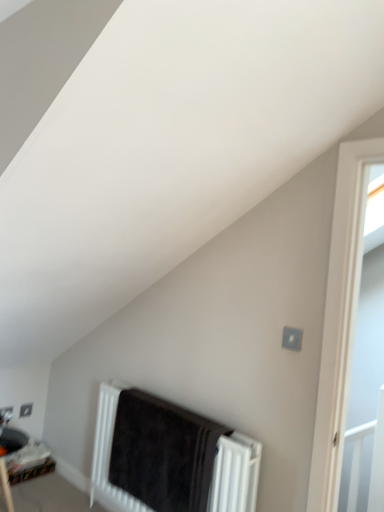
I want to click on white metallic radiator at lower center, so click(x=237, y=475).

This screenshot has height=512, width=384. Describe the element at coordinates (237, 475) in the screenshot. I see `white metallic radiator at lower center` at that location.

I want to click on white metallic radiator at lower center, so click(237, 475).